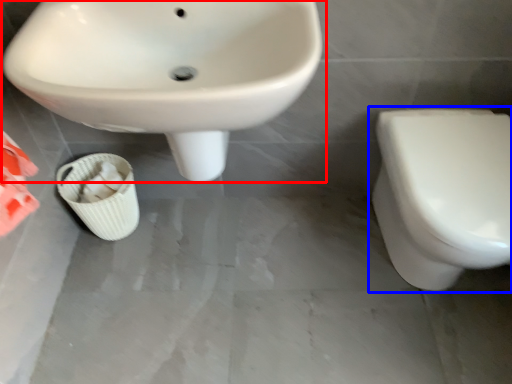
Question: Which object appears farthest to the camera in this image, sink (highlighted by a red box) or toilet (highlighted by a blue box)?

Choices:
 (A) sink
 (B) toilet

Answer: (B)